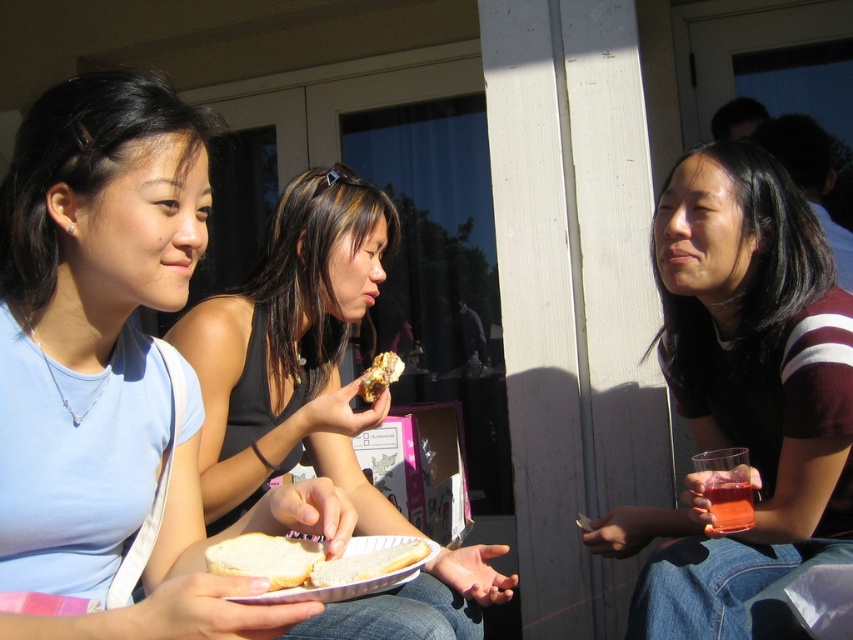
Which is in front, point (807, 372) or point (717, 522)?

Positioned in front is point (717, 522).

Who is shorter, matte black shirt at center or translucent glass cup at lower right?

Standing shorter between the two is translucent glass cup at lower right.

Which is in front, point (630, 634) or point (746, 525)?

Positioned in front is point (630, 634).

Where is `matte black shirt at center`? Image resolution: width=853 pixels, height=640 pixels. matte black shirt at center is located at coordinates (743, 397).

Is white bread at lower center wider than white bread at center?

No, white bread at lower center is not wider than white bread at center.

Does white bread at lower center appear on the left side of white bread at center?

Indeed, white bread at lower center is positioned on the left side of white bread at center.

Who is more distant from viewer, (276,540) or (318,566)?

The point (276,540) is behind.

Locate an element on the screen. This screenshot has height=640, width=853. white bread at lower center is located at coordinates (265, 557).

Does matte black shirt at center appear over white bread at lower center?

Correct, matte black shirt at center is located above white bread at lower center.

In the scene shown: Does matte black shirt at center have a lesser width compared to white bread at lower center?

No, matte black shirt at center is not thinner than white bread at lower center.

The image size is (853, 640). Identify the location of matte black shirt at center. (743, 397).